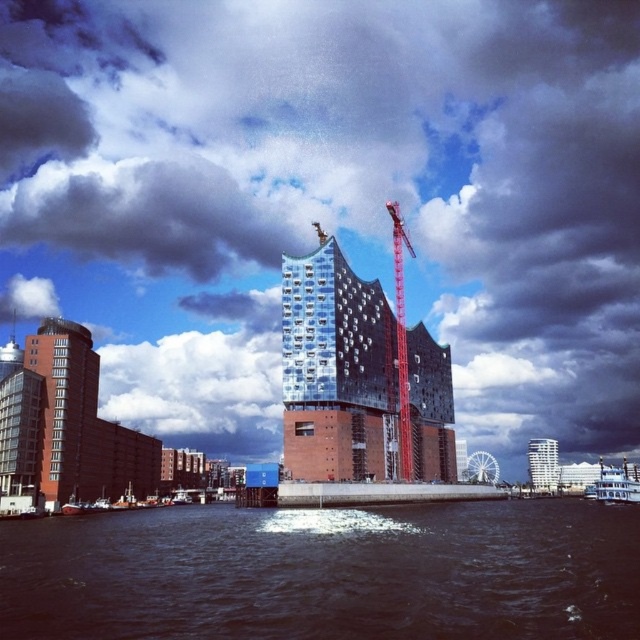
Question: Which of the following is the farthest from the observer?

Choices:
 (A) reflective glass building at center
 (B) white glass tower at right

Answer: (B)

Question: Which of the following is the closest to the observer?

Choices:
 (A) (76, 380)
 (B) (428, 468)

Answer: (A)

Question: Is dark water at lower center in front of metallic red crane at center?

Choices:
 (A) yes
 (B) no

Answer: (A)

Question: Which object is the closest to the cloudy sky at upper center?

Choices:
 (A) metallic red crane at center
 (B) reflective glass building at center
 (C) brick textured building at left
 (D) white glass tower at right

Answer: (B)

Question: Is dark water at lower center below metallic red crane at center?

Choices:
 (A) yes
 (B) no

Answer: (A)

Question: From the image, what is the correct spatial relationship of cloudy sky at upper center in relation to dark water at lower center?

Choices:
 (A) above
 (B) below

Answer: (A)